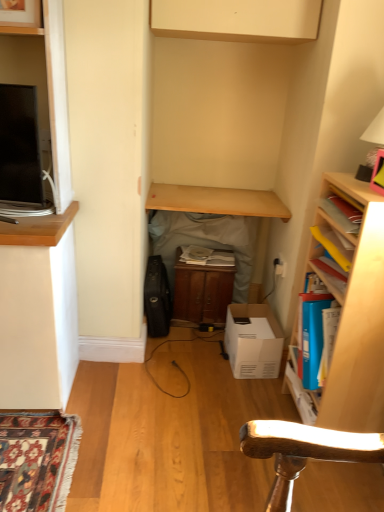
At what (x,y) coordinates should I click in order to perform the action: click on vacant area in front of wooden cabinet at center, placed as the 1th table when sorted from bottom to top. Please return your answer as a coordinate pair (x, y). Looking at the image, I should click on (192, 353).